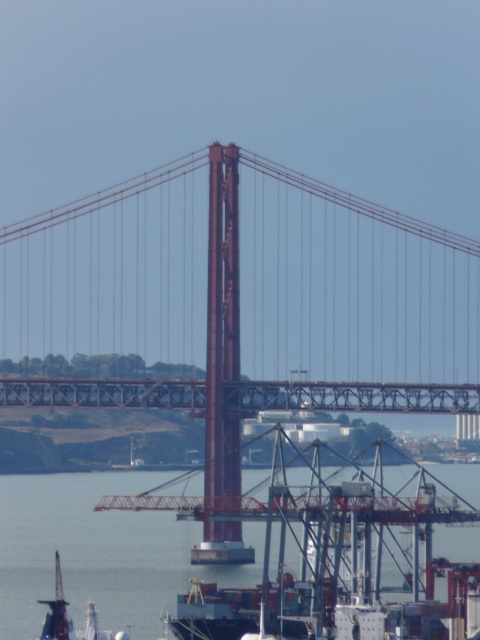
Does red metal suspension bridge at center have a smaller size compared to gray metallic water at lower center?

No, red metal suspension bridge at center is not smaller than gray metallic water at lower center.

Who is positioned more to the right, red metal suspension bridge at center or gray metallic water at lower center?

red metal suspension bridge at center is more to the right.

This screenshot has height=640, width=480. In order to click on red metal suspension bridge at center in this screenshot , I will do `click(247, 298)`.